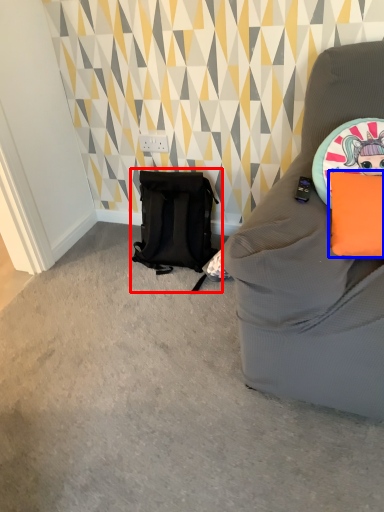
Question: Which object is closer to the camera taking this photo, backpack (highlighted by a red box) or pillow (highlighted by a blue box)?

Choices:
 (A) backpack
 (B) pillow

Answer: (B)